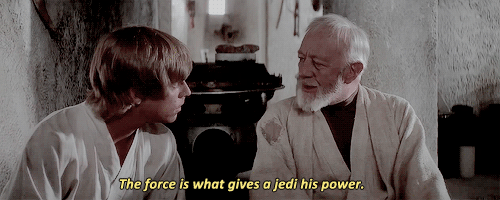
Identify the location of windows. The image size is (500, 200). (216, 8).